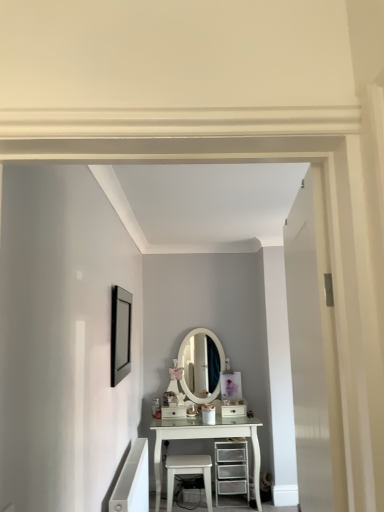
The height and width of the screenshot is (512, 384). I want to click on vacant area on top of white glossy drawer at center, marked as the 2th drawer in a right-to-left arrangement (from a real-world perspective), so click(171, 404).